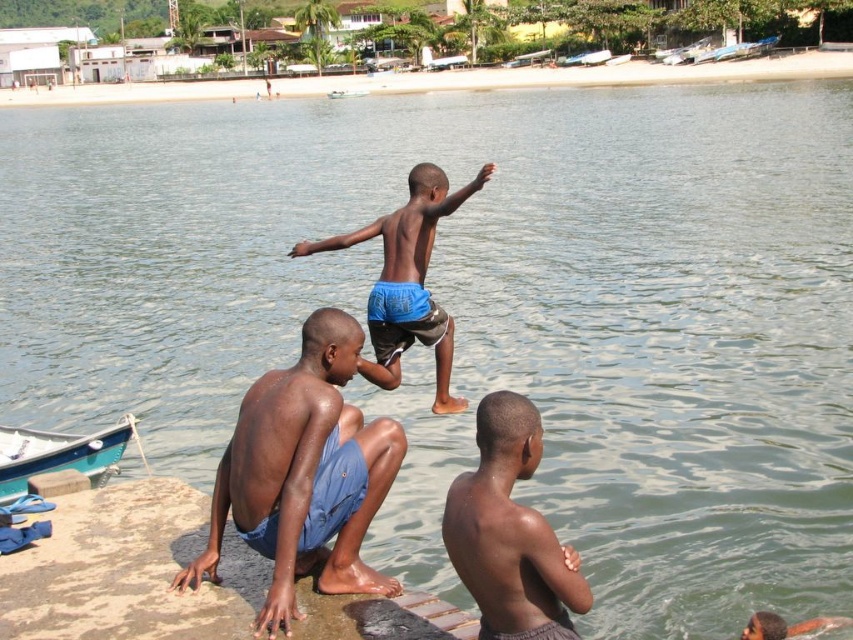
You are a photographer on the beach and want to capture a photo of the blue shorts at center and the teal wooden boat at lower left. Which object should you focus on first if you want the closest subject to be sharp?

The blue shorts at center is in front of the teal wooden boat at lower left, so you should focus on the blue shorts at center first to ensure the closest subject is sharp.

You are a photographer at the beach and want to capture a photo of the blue shorts at center and the teal wooden boat at lower left. Which object should you focus on first if you want to ensure both are in focus without adjusting your camera settings?

The blue shorts at center is taller than the teal wooden boat at lower left, so you should focus on the blue shorts at center first since it is larger and requires more detailed focus to ensure both are in focus.

You are a photographer standing at the edge of the water. You want to take a photo that includes both the point at coordinates point (0, 492) and point (329, 97). Which point will appear closer to the bottom edge of your camera view?

Point (0, 492) will appear closer to the bottom edge of your camera view because it is closer to the camera than point (329, 97).